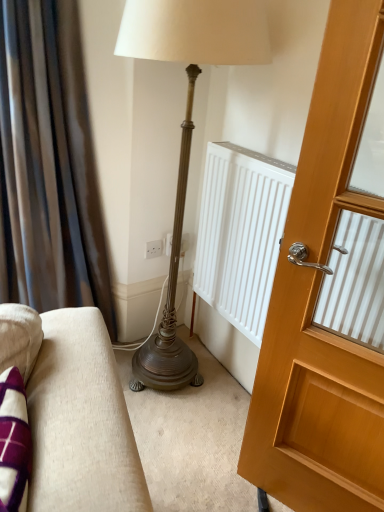
Question: Does point (81, 72) appear closer or farther from the camera than point (294, 422)?

Choices:
 (A) farther
 (B) closer

Answer: (A)

Question: Considering the positions of brown velvet curtain at left and wooden door at right in the image, is brown velvet curtain at left taller or shorter than wooden door at right?

Choices:
 (A) short
 (B) tall

Answer: (B)

Question: In the image, is brown velvet curtain at left positioned in front of or behind wooden door at right?

Choices:
 (A) behind
 (B) front

Answer: (A)

Question: From the image's perspective, is wooden door at right above or below brown velvet curtain at left?

Choices:
 (A) below
 (B) above

Answer: (A)

Question: Which is correct: wooden door at right is inside brown velvet curtain at left, or outside of it?

Choices:
 (A) inside
 (B) outside

Answer: (B)

Question: From a real-world perspective, is wooden door at right positioned above or below brown velvet curtain at left?

Choices:
 (A) above
 (B) below

Answer: (B)

Question: Is wooden door at right in front of or behind brown velvet curtain at left in the image?

Choices:
 (A) behind
 (B) front

Answer: (B)